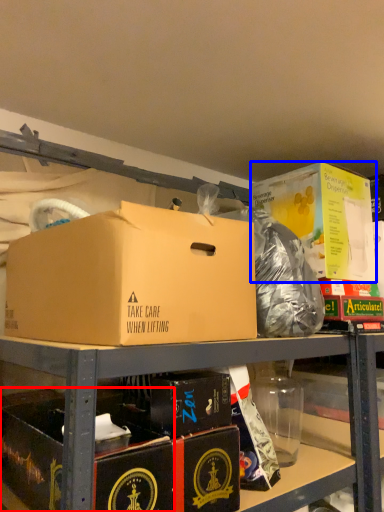
Question: Among these objects, which one is farthest to the camera, box (highlighted by a red box) or box (highlighted by a blue box)?

Choices:
 (A) box
 (B) box

Answer: (B)